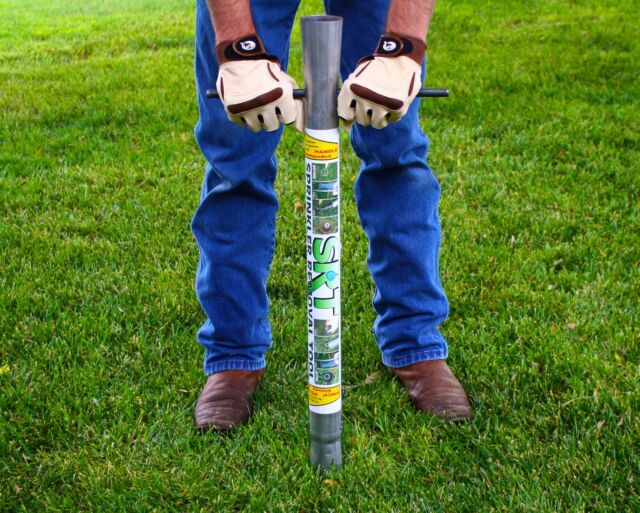
You are a GUI agent. You are given a task and a screenshot of the screen. Output one action in this format:
    pyautogui.click(x=<x>, y=<y>)
    Task: Click on the right handle
    The width and height of the screenshot is (640, 513).
    Given the screenshot: What is the action you would take?
    211,92